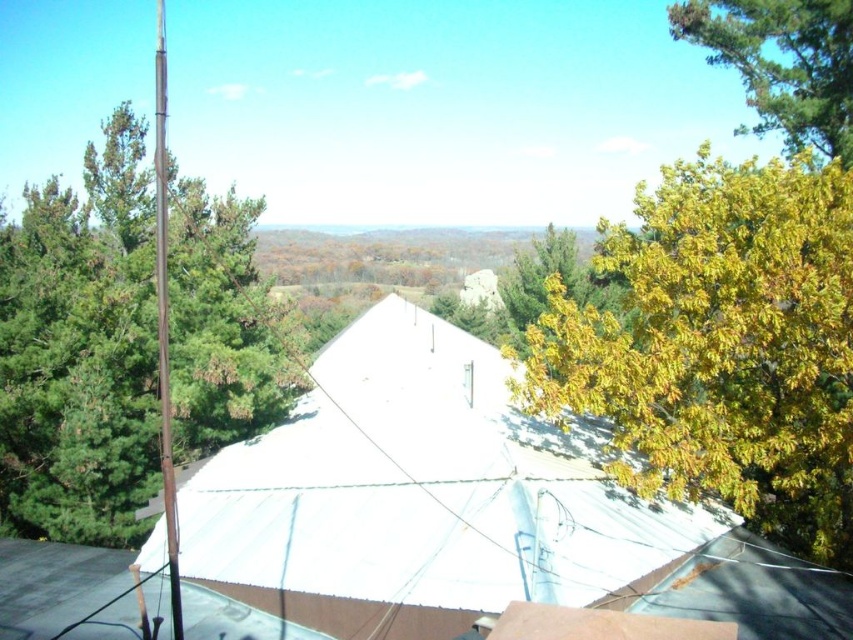
You are standing on the roof and looking out at the landscape. There are two points marked on the roof, one at point coordinates point (x=465, y=364) and another at point coordinates point (x=836, y=305). Which point is closer to you when you are facing the direction of the view?

Point (x=836, y=305) is closer to you because it is in front of point (x=465, y=364) based on their positions.